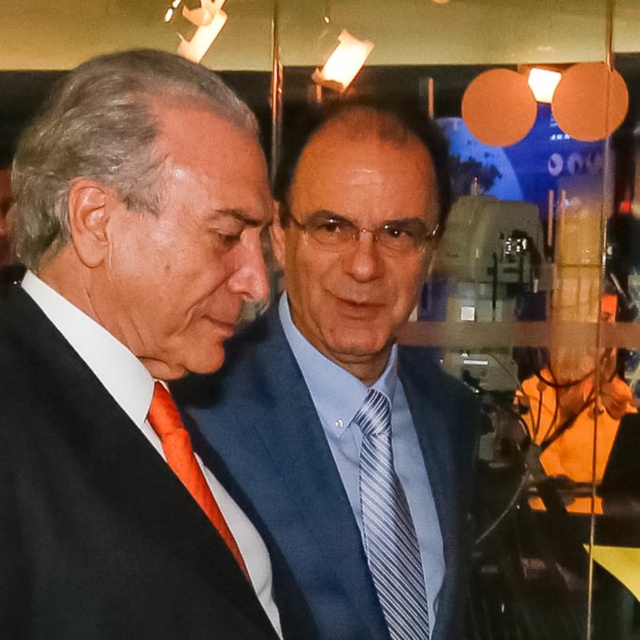
Is blue satin suit at center smaller than blue striped tie at center?

Incorrect, blue satin suit at center is not smaller in size than blue striped tie at center.

You are a GUI agent. You are given a task and a screenshot of the screen. Output one action in this format:
    pyautogui.click(x=<x>, y=<y>)
    Task: Click on the blue satin suit at center
    
    Given the screenshot: What is the action you would take?
    pyautogui.click(x=346, y=378)

Who is more forward, [451,550] or [358,420]?

Positioned in front is point [358,420].

I want to click on blue satin suit at center, so click(x=346, y=378).

Is matte black suit at left wider than blue satin suit at center?

No.

You are a GUI agent. You are given a task and a screenshot of the screen. Output one action in this format:
    pyautogui.click(x=<x>, y=<y>)
    Task: Click on the matte black suit at left
    The height and width of the screenshot is (640, 640).
    Given the screenshot: What is the action you would take?
    pyautogui.click(x=128, y=358)

Locate an element on the screen. The height and width of the screenshot is (640, 640). matte black suit at left is located at coordinates coord(128,358).

Identify the location of matte black suit at left. coord(128,358).

Where is `matte black suit at left`? matte black suit at left is located at coordinates (128, 358).